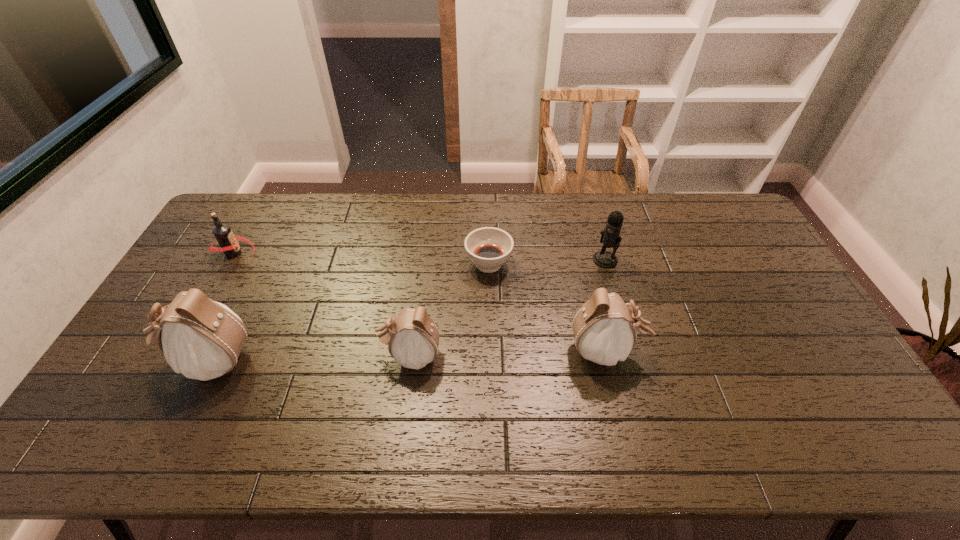
This screenshot has width=960, height=540. What are the coordinates of `object located in the near left corner section of the desktop` in the screenshot? It's located at (202, 339).

Identify the location of vacant area at the far edge. (365, 224).

The width and height of the screenshot is (960, 540). In order to click on vacant space at the near edge of the desktop in this screenshot , I will do `click(243, 388)`.

The height and width of the screenshot is (540, 960). In order to click on free space at the left edge of the desktop in this screenshot , I will do `click(225, 266)`.

Where is `free space at the far left corner of the desktop`? Image resolution: width=960 pixels, height=540 pixels. free space at the far left corner of the desktop is located at coordinates (247, 217).

In order to click on free space at the far right corner of the desktop in this screenshot , I will do `click(714, 197)`.

This screenshot has width=960, height=540. Identify the location of free space between the shortest pouch and the third object from right to left. (449, 310).

Image resolution: width=960 pixels, height=540 pixels. I want to click on vacant space that's between the root beer and the shortest object, so click(x=362, y=259).

Find the location of a particular element. empty location between the fourth object from left to right and the root beer is located at coordinates (362, 259).

At what (x,y) coordinates should I click in order to perform the action: click on vacant space that's between the fourth object from left to right and the third object from left to right. Please return your answer as a coordinate pair (x, y). Image resolution: width=960 pixels, height=540 pixels. Looking at the image, I should click on (449, 310).